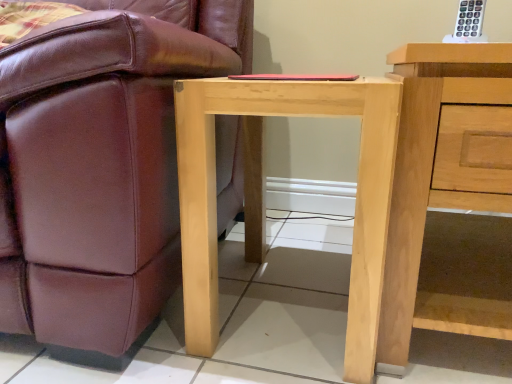
In order to click on free space between natural wood table at center and natural wood nightstand at right in this screenshot , I will do `click(316, 253)`.